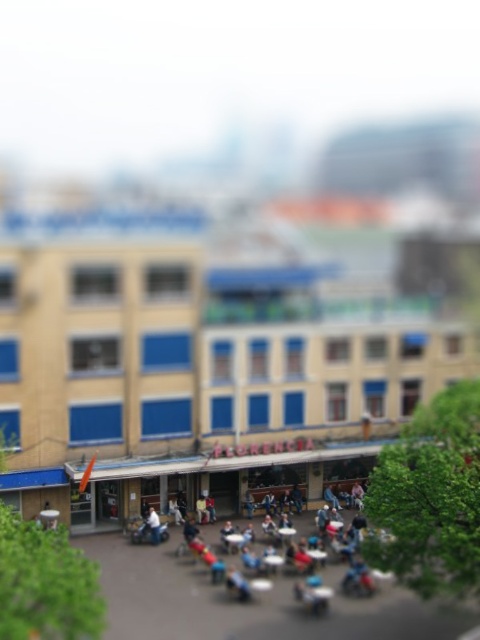
Question: From the image, what is the correct spatial relationship of blue fabric chair at center in relation to white fabric jacket at center?

Choices:
 (A) right
 (B) left

Answer: (A)

Question: Which point appears farthest from the camera in this image?

Choices:
 (A) coord(159,524)
 (B) coord(228,525)

Answer: (A)

Question: Is blue fabric chair at center below white fabric jacket at center?

Choices:
 (A) no
 (B) yes

Answer: (B)

Question: Which point appears farthest from the camera in this image?

Choices:
 (A) (154, 525)
 (B) (192, 529)

Answer: (A)

Question: Is blue fabric chair at center to the left of white fabric jacket at center from the viewer's perspective?

Choices:
 (A) yes
 (B) no

Answer: (B)